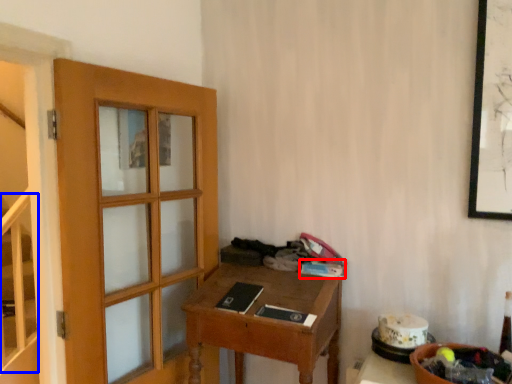
Question: Which object appears farthest to the camera in this image, book (highlighted by a red box) or stairwell (highlighted by a blue box)?

Choices:
 (A) book
 (B) stairwell

Answer: (B)